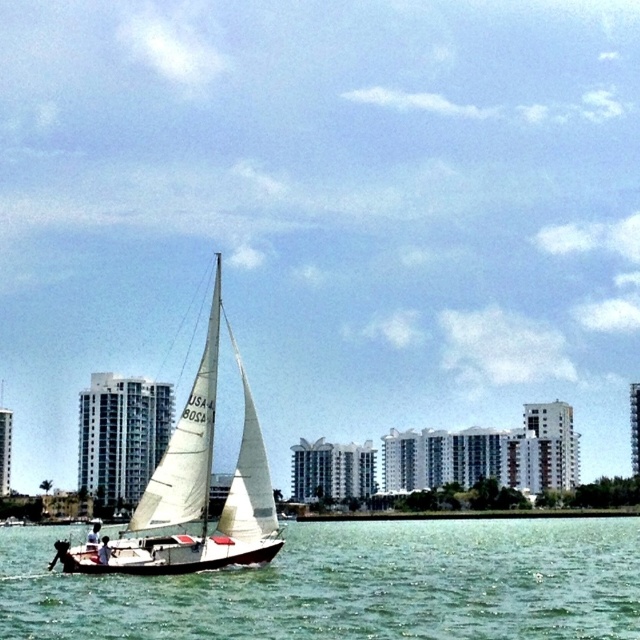
The height and width of the screenshot is (640, 640). What do you see at coordinates (349, 584) in the screenshot? I see `green water at center` at bounding box center [349, 584].

Between green water at center and white sailboat at center, which one has more height?

With more height is white sailboat at center.

Between point (132, 584) and point (208, 442), which one is positioned in front?

Point (132, 584)

Locate an element on the screen. This screenshot has width=640, height=640. green water at center is located at coordinates (349, 584).